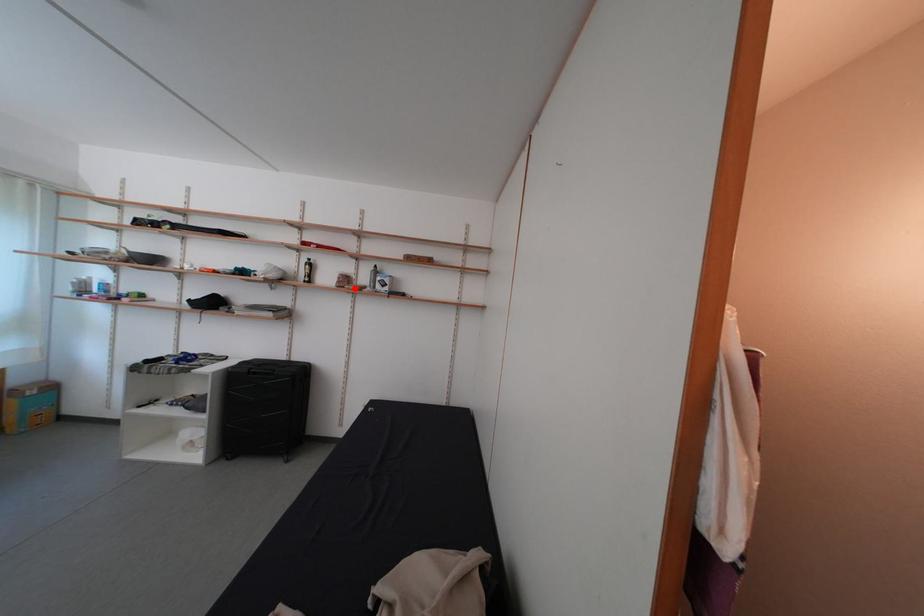
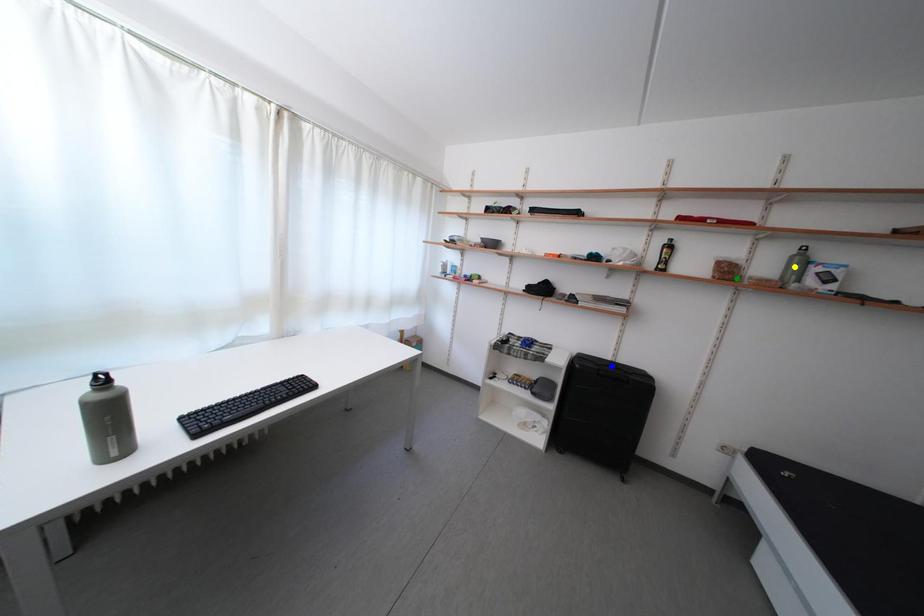
Question: I am providing you with two images of the same scene from different viewpoints. A red point is marked on the first image. You are given multiple points on the second image. Which spot in image 2 lines up with the point in image 1?

Choices:
 (A) yellow point
 (B) blue point
 (C) green point

Answer: (C)